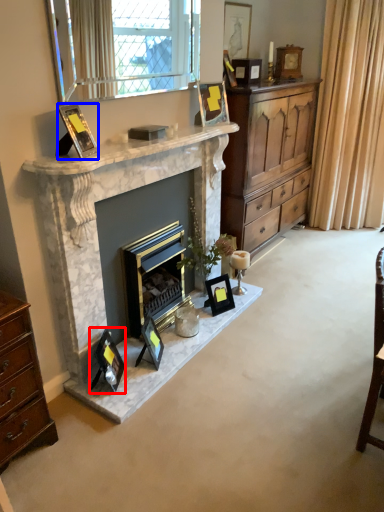
Question: Which object appears closest to the camera in this image, picture frame (highlighted by a red box) or picture frame (highlighted by a blue box)?

Choices:
 (A) picture frame
 (B) picture frame

Answer: (B)